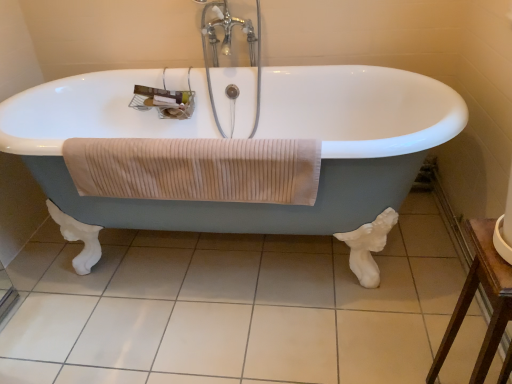
The image size is (512, 384). In order to click on free spot below white glossy bathtub at center (from a real-world perspective) in this screenshot , I will do `click(217, 262)`.